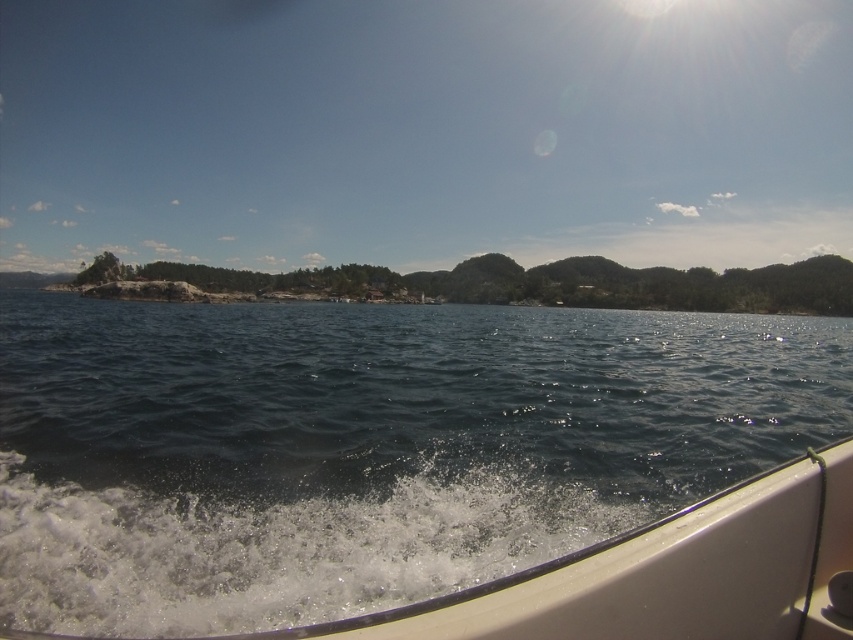
From the perspective of someone on the boat, which object is positioned to the right of the other between the dark blue water at center and the transparent blue sky at upper center?

The dark blue water at center is to the right of the transparent blue sky at upper center.

You are on a boat and want to compare the width of the dark blue water at center and the transparent blue sky at upper center. Which one is narrower?

The dark blue water at center is narrower than the transparent blue sky at upper center.